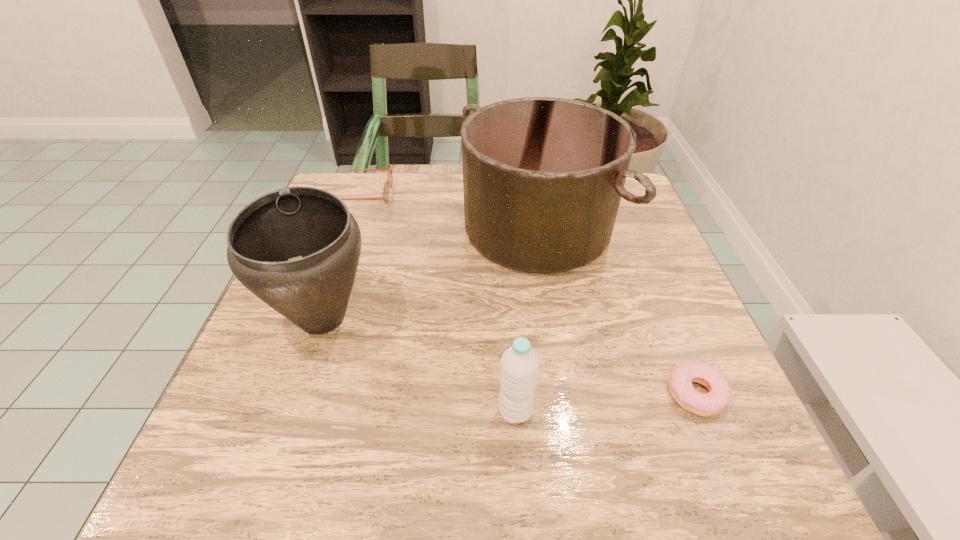
Find the location of a particular element. The height and width of the screenshot is (540, 960). free area in between the water bottle and the pan is located at coordinates (526, 320).

Locate an element on the screen. object that is the second closest to the pan is located at coordinates (385, 196).

You are a GUI agent. You are given a task and a screenshot of the screen. Output one action in this format:
    pyautogui.click(x=<x>, y=<y>)
    Task: Click on the object that is the second nearest to the shortest object
    The width and height of the screenshot is (960, 540).
    Given the screenshot: What is the action you would take?
    pyautogui.click(x=519, y=364)

Where is `vacant area in the image that satisfies the following two spatial constraints: 1. on the front side of the pan; 2. on the left side of the doughnut`? vacant area in the image that satisfies the following two spatial constraints: 1. on the front side of the pan; 2. on the left side of the doughnut is located at coordinates (564, 394).

In order to click on free location that satisfies the following two spatial constraints: 1. on the front-facing side of the second shortest object; 2. on the back side of the pan in this screenshot , I will do `click(350, 228)`.

This screenshot has height=540, width=960. I want to click on vacant space that satisfies the following two spatial constraints: 1. on the front side of the urn; 2. on the left side of the doughnut, so click(x=297, y=394).

You are a GUI agent. You are given a task and a screenshot of the screen. Output one action in this format:
    pyautogui.click(x=<x>, y=<y>)
    Task: Click on the free space in the image that satisfies the following two spatial constraints: 1. on the front-facing side of the fourth tallest object; 2. on the left side of the urn
    Image resolution: width=960 pixels, height=540 pixels.
    Given the screenshot: What is the action you would take?
    pyautogui.click(x=319, y=319)

Find the location of a particular element. The width and height of the screenshot is (960, 540). free space that satisfies the following two spatial constraints: 1. on the front side of the doughnut; 2. on the right side of the pan is located at coordinates (564, 394).

The width and height of the screenshot is (960, 540). I want to click on vacant space that satisfies the following two spatial constraints: 1. on the back side of the pan; 2. on the left side of the third tallest object, so click(x=503, y=228).

Identify the location of vacant point that satisfies the following two spatial constraints: 1. on the front-facing side of the sunglasses; 2. on the back side of the urn. The width and height of the screenshot is (960, 540). (319, 319).